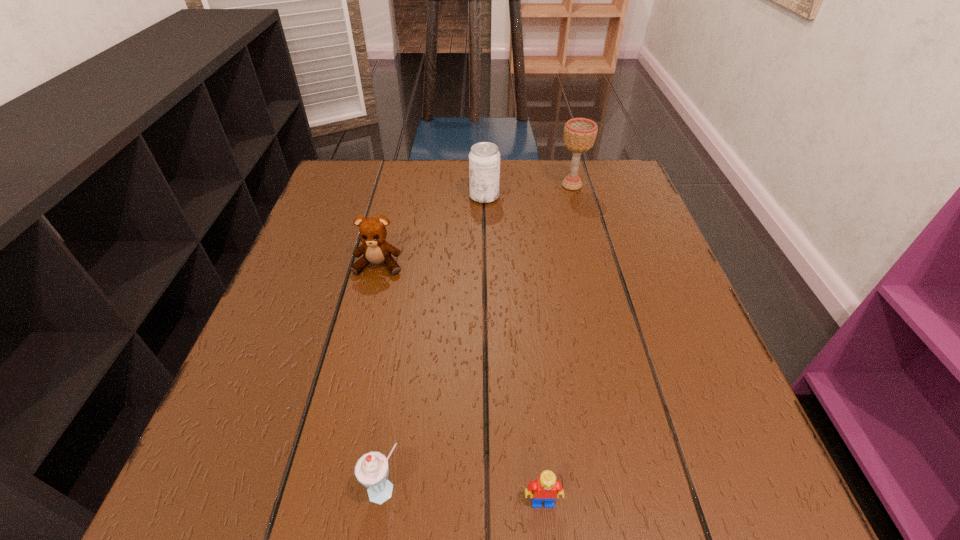
Where is `free space at the right edge`? free space at the right edge is located at coordinates (658, 237).

You are a GUI agent. You are given a task and a screenshot of the screen. Output one action in this format:
    pyautogui.click(x=<x>, y=<y>)
    Task: Click on the free location at the far left corner
    This screenshot has height=540, width=960.
    Given the screenshot: What is the action you would take?
    (x=369, y=171)

This screenshot has width=960, height=540. In the image, there is a desktop. Identify the location of vacant space at the near right corner. (703, 461).

Where is `free spot between the fourth object from right to left and the soda can`? free spot between the fourth object from right to left and the soda can is located at coordinates (435, 343).

The image size is (960, 540). In order to click on free spot between the tallest object and the third object from left to right in this screenshot , I will do `click(528, 191)`.

Where is `unoccupied area between the rightmost object and the leftmost object`? Image resolution: width=960 pixels, height=540 pixels. unoccupied area between the rightmost object and the leftmost object is located at coordinates (475, 225).

Identify the location of vacant space that is in between the soda can and the leftmost object. (431, 231).

Find the location of `empty space that is in between the leftmost object and the tallest object`. empty space that is in between the leftmost object and the tallest object is located at coordinates (475, 225).

Find the location of a particular element. free space between the third nearest object and the second object from left to right is located at coordinates (382, 378).

Locate an element on the screen. This screenshot has height=540, width=960. vacant region between the milkshake and the fourth object from left to right is located at coordinates (464, 496).